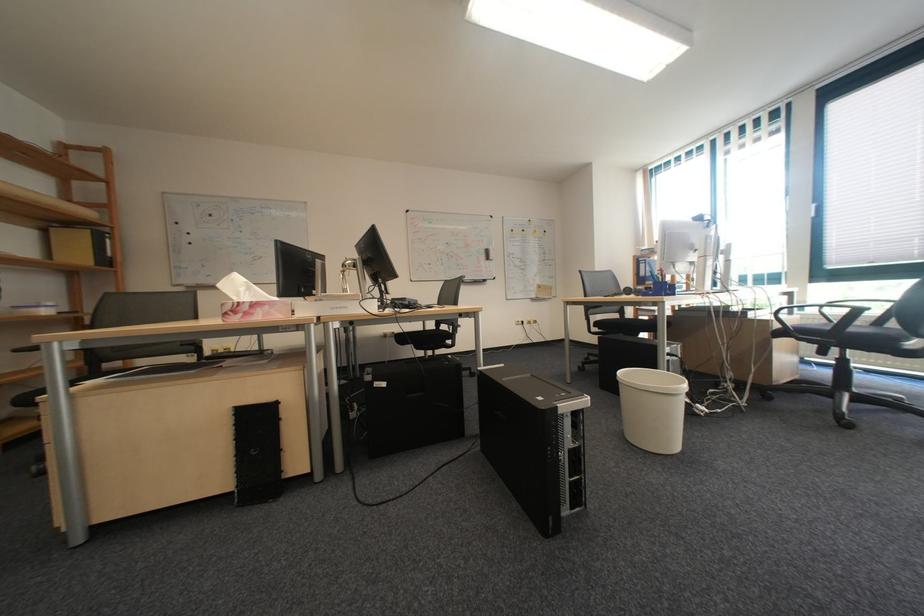
The width and height of the screenshot is (924, 616). Find the location of `black chair armrest`. black chair armrest is located at coordinates (626, 325).